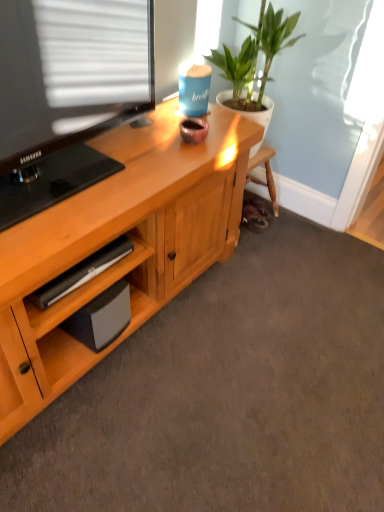
Question: Considering the relative positions of black matte speaker at lower left and green leafy plant at upper right in the image provided, is black matte speaker at lower left to the right of green leafy plant at upper right from the viewer's perspective?

Choices:
 (A) yes
 (B) no

Answer: (B)

Question: Is black matte speaker at lower left not inside green leafy plant at upper right?

Choices:
 (A) yes
 (B) no

Answer: (A)

Question: From a real-world perspective, is black matte speaker at lower left physically below green leafy plant at upper right?

Choices:
 (A) no
 (B) yes

Answer: (B)

Question: Is black matte speaker at lower left bigger than green leafy plant at upper right?

Choices:
 (A) yes
 (B) no

Answer: (B)

Question: Is black matte speaker at lower left closer to the viewer compared to green leafy plant at upper right?

Choices:
 (A) yes
 (B) no

Answer: (A)

Question: From a real-world perspective, is black matte speaker at lower left on green leafy plant at upper right?

Choices:
 (A) no
 (B) yes

Answer: (A)

Question: Is the position of green leafy plant at upper right more distant than that of black matte speaker at lower left?

Choices:
 (A) no
 (B) yes

Answer: (B)

Question: From a real-world perspective, is green leafy plant at upper right over black matte speaker at lower left?

Choices:
 (A) yes
 (B) no

Answer: (A)

Question: Could you tell me if green leafy plant at upper right is turned towards black matte speaker at lower left?

Choices:
 (A) no
 (B) yes

Answer: (A)

Question: Considering the relative sizes of green leafy plant at upper right and black matte speaker at lower left in the image provided, is green leafy plant at upper right shorter than black matte speaker at lower left?

Choices:
 (A) yes
 (B) no

Answer: (B)

Question: Is green leafy plant at upper right bigger than black matte speaker at lower left?

Choices:
 (A) yes
 (B) no

Answer: (A)

Question: Does green leafy plant at upper right lie in front of black matte speaker at lower left?

Choices:
 (A) yes
 (B) no

Answer: (B)

Question: From their relative heights in the image, would you say green leafy plant at upper right is taller or shorter than black matte speaker at lower left?

Choices:
 (A) tall
 (B) short

Answer: (A)